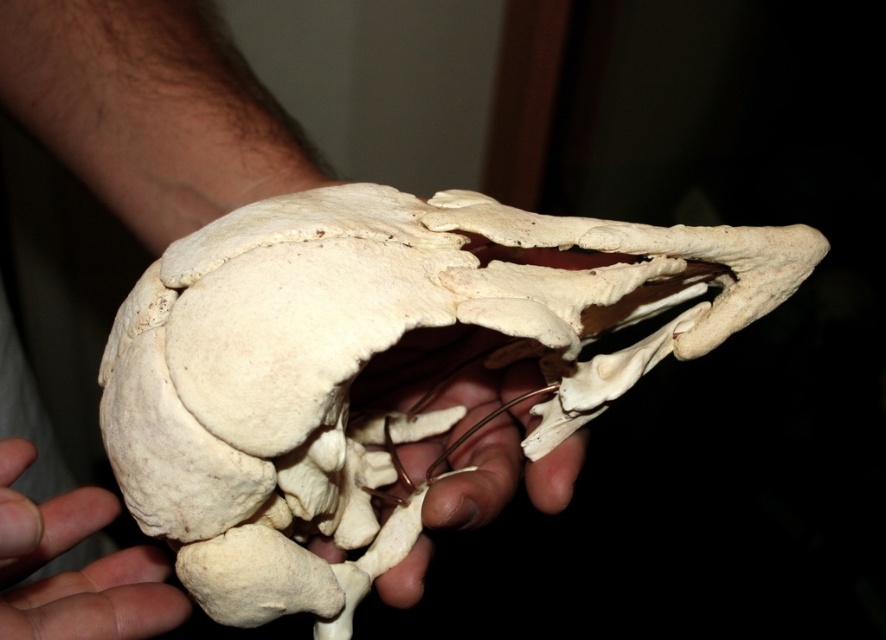
From the picture: You are a forensic scientist examining a crime scene. You find two objects at the center of the image, a white bone skull at center and a white matte bone at center. Which object has a greater width?

The white bone skull at center has a greater width than the white matte bone at center according to the description.